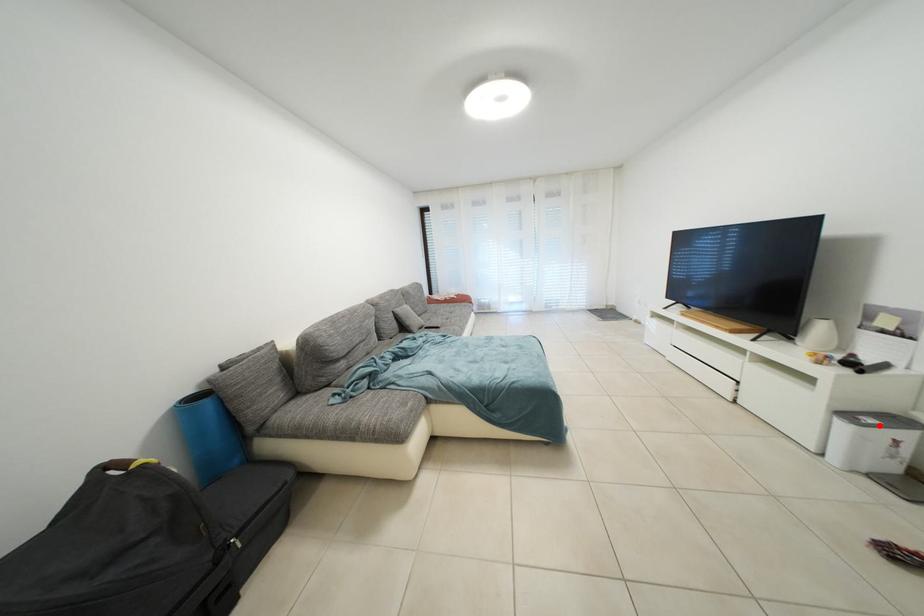
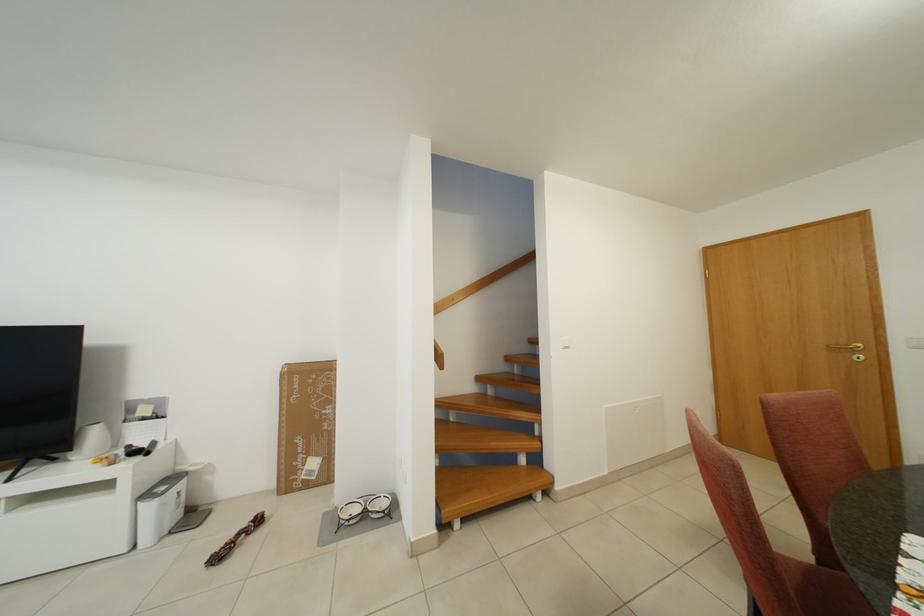
Locate, in the second image, the point that corresponds to the highlighted location in the first image.

(171, 493)